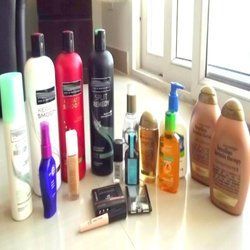
Where is `counter`? This screenshot has height=250, width=250. counter is located at coordinates (167, 231).